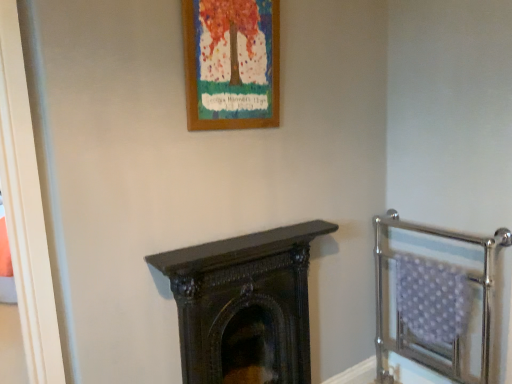
Measure the distance between dark wood fireplace at center and camera.

A distance of 1.43 meters exists between dark wood fireplace at center and camera.

Where is `polished chrome balustrade at right`? The height and width of the screenshot is (384, 512). polished chrome balustrade at right is located at coordinates (435, 300).

Identify the location of wooden frame at upper center. Image resolution: width=512 pixels, height=384 pixels. (231, 63).

Looking at the image, does polished chrome balustrade at right seem bigger or smaller compared to wooden frame at upper center?

polished chrome balustrade at right is bigger than wooden frame at upper center.

From a real-world perspective, who is located lower, polished chrome balustrade at right or wooden frame at upper center?

polished chrome balustrade at right.

Is polished chrome balustrade at right directly adjacent to wooden frame at upper center?

No, polished chrome balustrade at right is not in contact with wooden frame at upper center.

In the scene shown: Is polished chrome balustrade at right inside or outside of wooden frame at upper center?

polished chrome balustrade at right lies outside wooden frame at upper center.

Considering the positions of objects dark wood fireplace at center and wooden frame at upper center in the image provided, who is behind, dark wood fireplace at center or wooden frame at upper center?

dark wood fireplace at center is further from the camera.

Image resolution: width=512 pixels, height=384 pixels. I want to click on fireplace below the wooden frame at upper center (from the image's perspective), so [244, 306].

Consider the image. Can you confirm if dark wood fireplace at center is taller than wooden frame at upper center?

Correct, dark wood fireplace at center is much taller as wooden frame at upper center.

From the image's perspective, is dark wood fireplace at center below wooden frame at upper center?

Yes.

From the image's perspective, which is below, wooden frame at upper center or dark wood fireplace at center?

dark wood fireplace at center appears lower in the image.

Can you tell me how much wooden frame at upper center and dark wood fireplace at center differ in facing direction?

wooden frame at upper center and dark wood fireplace at center are facing 1.01 degrees away from each other.

Considering the sizes of objects wooden frame at upper center and dark wood fireplace at center in the image provided, who is shorter, wooden frame at upper center or dark wood fireplace at center?

Standing shorter between the two is wooden frame at upper center.

Identify the location of fireplace that appears below the wooden frame at upper center (from the image's perspective). The height and width of the screenshot is (384, 512). tap(244, 306).

Which is closer to the camera, (446,270) or (188,353)?

Point (446,270) appears to be farther away from the viewer than point (188,353).

Which object is thinner, polished chrome balustrade at right or dark wood fireplace at center?

Thinner between the two is dark wood fireplace at center.

From the image's perspective, who appears lower, polished chrome balustrade at right or dark wood fireplace at center?

dark wood fireplace at center, from the image's perspective.

From a real-world perspective, between polished chrome balustrade at right and dark wood fireplace at center, who is vertically higher?

dark wood fireplace at center.

Which is nearer, (291, 294) or (412, 259)?

Positioned in front is point (291, 294).

Is dark wood fireplace at center inside or outside of polished chrome balustrade at right?

dark wood fireplace at center is spatially situated outside polished chrome balustrade at right.

Between wooden frame at upper center and polished chrome balustrade at right, which one has smaller size?

With smaller size is wooden frame at upper center.

Considering their positions, is wooden frame at upper center located in front of or behind polished chrome balustrade at right?

wooden frame at upper center is in front of polished chrome balustrade at right.

Is wooden frame at upper center facing towards polished chrome balustrade at right?

No.

How different are the orientations of wooden frame at upper center and polished chrome balustrade at right in degrees?

The angle between the facing direction of wooden frame at upper center and the facing direction of polished chrome balustrade at right is 90.3 degrees.

You are a GUI agent. You are given a task and a screenshot of the screen. Output one action in this format:
    pyautogui.click(x=<x>, y=<y>)
    Task: Click on the picture frame in front of the polished chrome balustrade at right
    
    Given the screenshot: What is the action you would take?
    pyautogui.click(x=231, y=63)

Where is `picture frame that appears above the dark wood fireplace at center (from a real-world perspective)`? picture frame that appears above the dark wood fireplace at center (from a real-world perspective) is located at coordinates (231, 63).

When comparing their distances from dark wood fireplace at center, does polished chrome balustrade at right or wooden frame at upper center seem further?

wooden frame at upper center lies further to dark wood fireplace at center than the other object.

From the picture: Estimate the real-world distances between objects in this image. Which object is closer to polished chrome balustrade at right, wooden frame at upper center or dark wood fireplace at center?

The object closer to polished chrome balustrade at right is dark wood fireplace at center.

In the scene shown: Considering their positions, is polished chrome balustrade at right positioned closer to wooden frame at upper center than dark wood fireplace at center?

dark wood fireplace at center lies closer to wooden frame at upper center than the other object.

Based on their spatial positions, is dark wood fireplace at center or wooden frame at upper center further from polished chrome balustrade at right?

wooden frame at upper center.

Based on their spatial positions, is dark wood fireplace at center or polished chrome balustrade at right closer to wooden frame at upper center?

dark wood fireplace at center.

Estimate the real-world distances between objects in this image. Which object is closer to dark wood fireplace at center, wooden frame at upper center or polished chrome balustrade at right?

polished chrome balustrade at right is closer to dark wood fireplace at center.

Identify the location of balustrade that lies between wooden frame at upper center and dark wood fireplace at center from top to bottom. (435, 300).